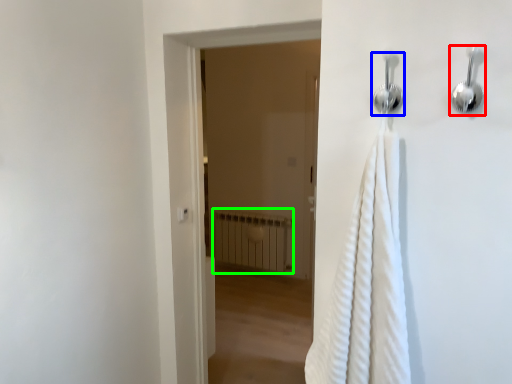
Question: Considering the real-world distances, which object is farthest from shower (highlighted by a red box)? shower (highlighted by a blue box) or radiator (highlighted by a green box)?

Choices:
 (A) shower
 (B) radiator

Answer: (B)